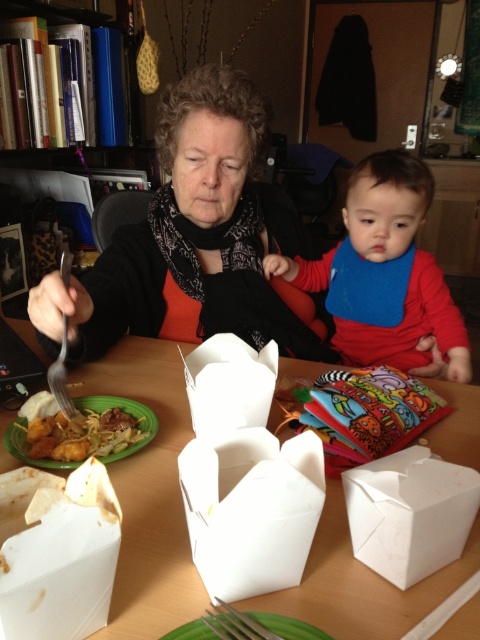
Can you confirm if blue fabric bib at right is positioned below golden crispy noodles at center?

No.

Is blue fabric bib at right behind golden crispy noodles at center?

Yes, it is.

Where is `blue fabric bib at right`? blue fabric bib at right is located at coordinates (388, 264).

Is matte black sweater at upper center smaller than wooden table at center?

Incorrect, matte black sweater at upper center is not smaller in size than wooden table at center.

Can you confirm if matte black sweater at upper center is taller than wooden table at center?

Indeed, matte black sweater at upper center has a greater height compared to wooden table at center.

Image resolution: width=480 pixels, height=640 pixels. Identify the location of matte black sweater at upper center. (194, 240).

Is point (190, 593) positioned behind point (415, 326)?

No, (190, 593) is closer to viewer.

I want to click on wooden table at center, so click(148, 493).

You are a GUI agent. You are given a task and a screenshot of the screen. Output one action in this format:
    pyautogui.click(x=<x>, y=<y>)
    Task: Click on the wooden table at center
    
    Given the screenshot: What is the action you would take?
    pyautogui.click(x=148, y=493)